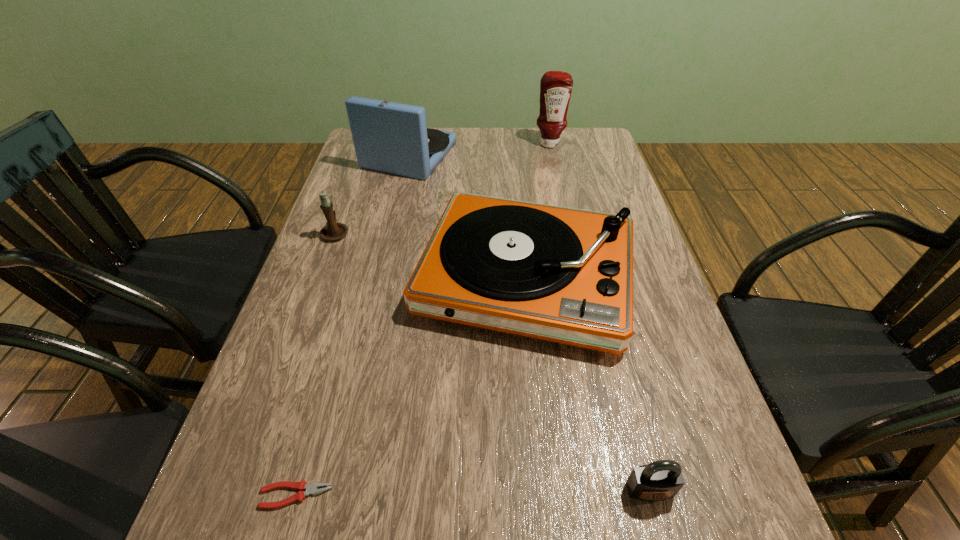
The width and height of the screenshot is (960, 540). Identify the location of padlock present at the right edge. (660, 480).

The image size is (960, 540). Find the location of `object that is at the far left corner`. object that is at the far left corner is located at coordinates (389, 137).

Where is `object that is at the far right corner`? object that is at the far right corner is located at coordinates (556, 86).

The height and width of the screenshot is (540, 960). Identify the location of free region at the far edge. (559, 159).

This screenshot has height=540, width=960. What are the coordinates of `vacant area at the left edge` in the screenshot? It's located at (350, 310).

In the image, there is a desktop. At what (x,y) coordinates should I click in order to perform the action: click on free space at the right edge. Please return your answer as a coordinate pair (x, y). The width and height of the screenshot is (960, 540). Looking at the image, I should click on (683, 376).

In the image, there is a desktop. Where is `blank space at the far right corner`? This screenshot has height=540, width=960. blank space at the far right corner is located at coordinates (603, 150).

Locate an element on the screen. This screenshot has height=540, width=960. free spot between the record player and the padlock is located at coordinates (588, 383).

Identify the location of free space between the candle holder and the phonograph record. (372, 194).

Identify the location of vacant space that's between the candle holder and the padlock. Image resolution: width=960 pixels, height=540 pixels. (492, 361).